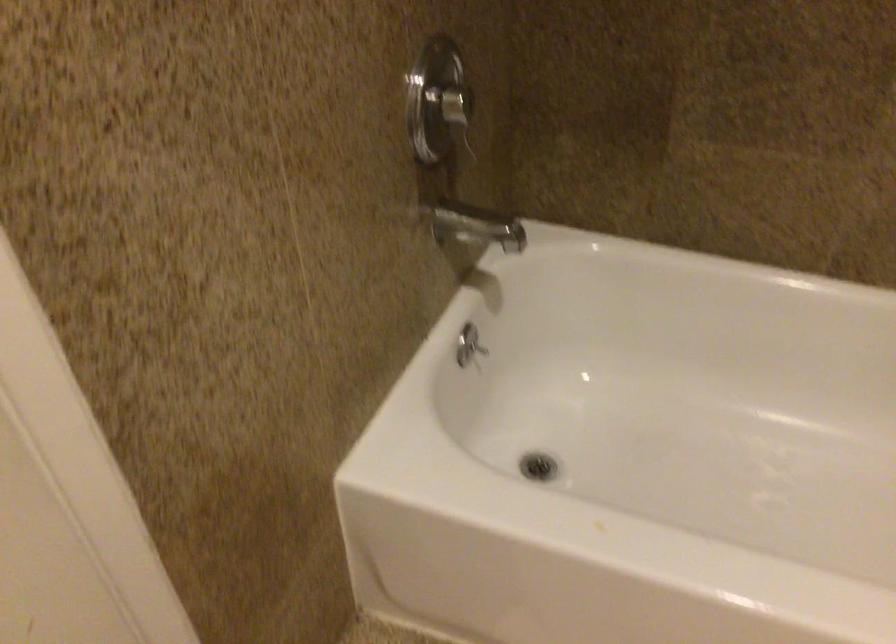
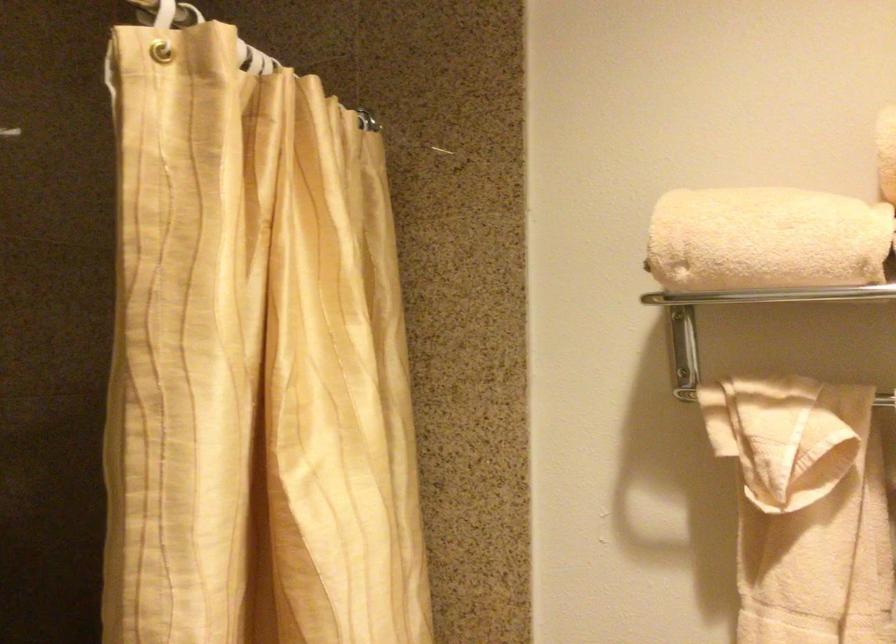
Question: The first image is from the beginning of the video and the second image is from the end. How did the camera likely rotate when shooting the video?

Choices:
 (A) Left
 (B) Right
 (C) Up
 (D) Down

Answer: (B)